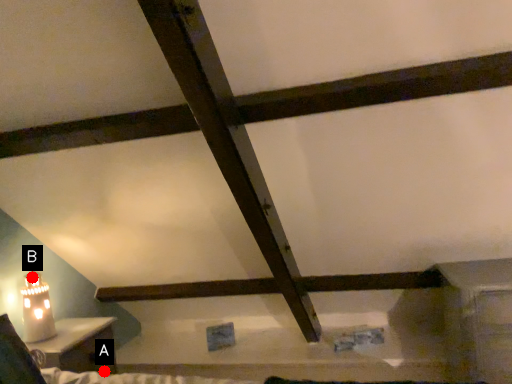
Question: Two points are circled on the image, labeled by A and B beside each circle. Among these points, which one is farthest from the camera?

Choices:
 (A) A is further
 (B) B is further

Answer: (A)